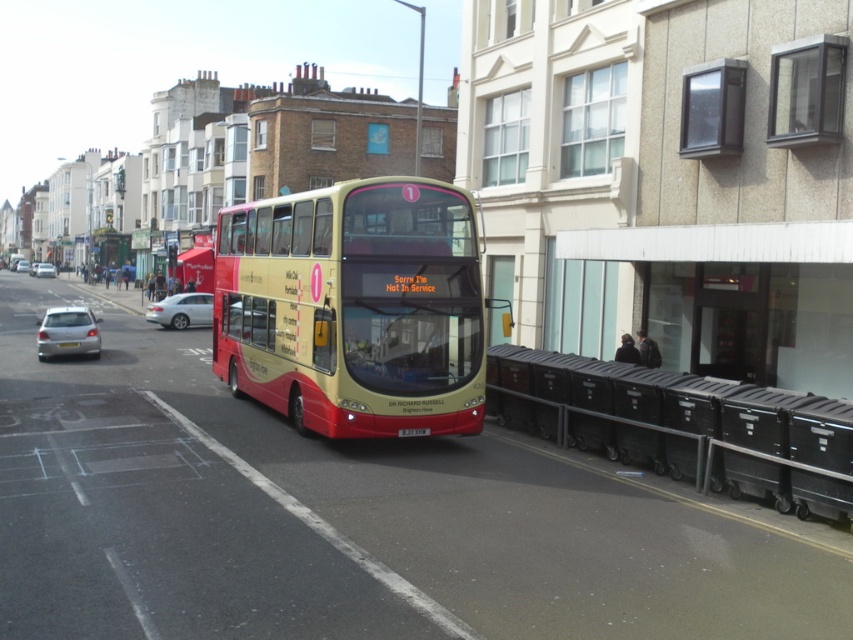
You are a delivery person who needs to park your van between the black plastic license plate at center and the silver metallic car at center. Can you fit your van, which is 2 meters long, in the space between them?

The black plastic license plate at center is shorter than the silver metallic car at center, but the description does not provide information about the distance between them. Therefore, it is unclear if the van can fit.